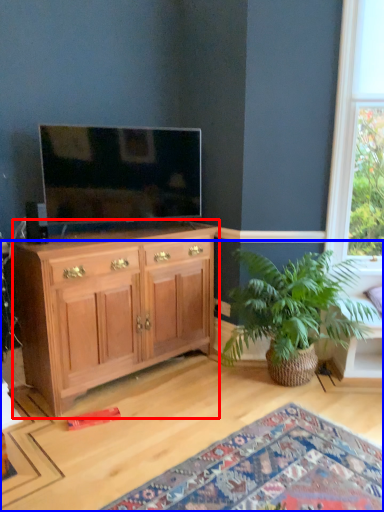
Question: Which object appears closest to the camera in this image, cabinetry (highlighted by a red box) or desk (highlighted by a blue box)?

Choices:
 (A) cabinetry
 (B) desk

Answer: (B)